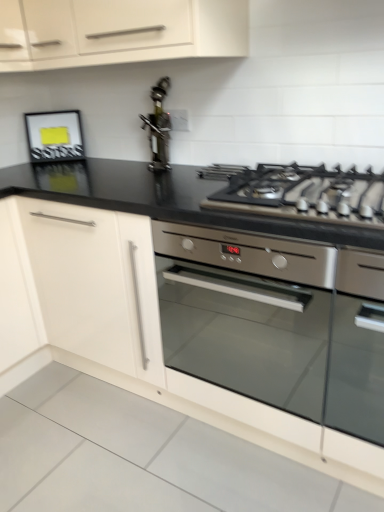
Question: Considering the positions of white matte cabinet at left, the first cabinetry positioned from the bottom, and stainless steel oil dispenser at center in the image, is white matte cabinet at left, the first cabinetry positioned from the bottom, taller or shorter than stainless steel oil dispenser at center?

Choices:
 (A) tall
 (B) short

Answer: (A)

Question: In the image, is white matte cabinet at left, the 2th cabinetry positioned from the top, positioned in front of or behind stainless steel oil dispenser at center?

Choices:
 (A) behind
 (B) front

Answer: (B)

Question: Estimate the real-world distances between objects in this image. Which object is farther from the satin silver oven at center?

Choices:
 (A) satin silver gas stove at upper right
 (B) matte black frame at upper left
 (C) white matte cabinet at upper left, arranged as the 1th cabinetry when viewed from the top
 (D) white matte cabinet at left, the first cabinetry positioned from the bottom
 (E) stainless steel oil dispenser at center

Answer: (B)

Question: Which object is the closest to the white matte cabinet at left, the first cabinetry positioned from the bottom?

Choices:
 (A) matte black frame at upper left
 (B) stainless steel oil dispenser at center
 (C) white matte cabinet at upper left, arranged as the 1th cabinetry when viewed from the top
 (D) satin silver oven at center
 (E) satin silver gas stove at upper right

Answer: (D)